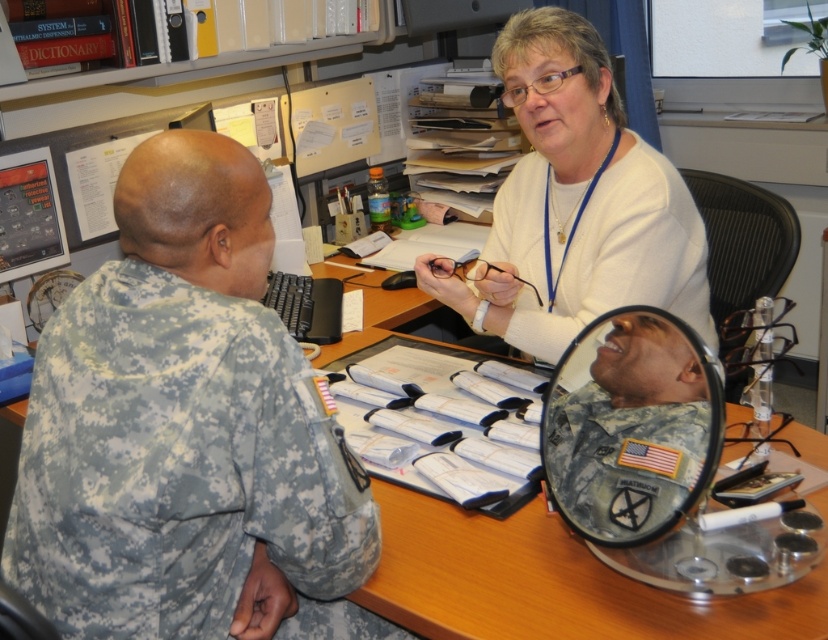
Question: Can you confirm if camouflage uniform at left is positioned to the left of white matte sweater at upper center?

Choices:
 (A) no
 (B) yes

Answer: (B)

Question: Where is camouflage uniform at left located in relation to white matte sweater at upper center in the image?

Choices:
 (A) below
 (B) above

Answer: (A)

Question: Which of the following is the farthest from the observer?

Choices:
 (A) (597, 106)
 (B) (321, 618)

Answer: (A)

Question: Is camouflage uniform at left to the right of white matte sweater at upper center from the viewer's perspective?

Choices:
 (A) yes
 (B) no

Answer: (B)